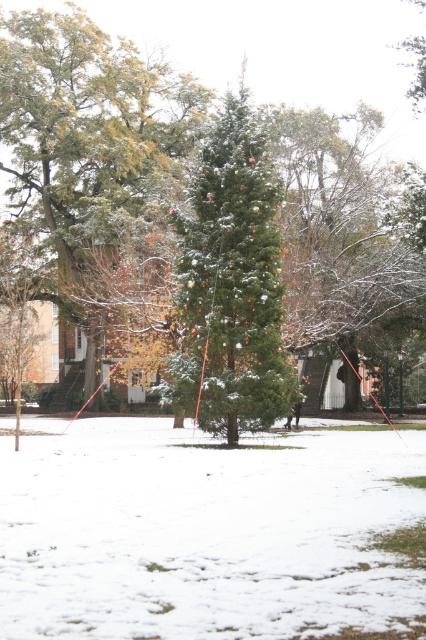
You are standing in the snowy outdoor scene and want to place a small gift exactly at the center of the white fluffy snow at center. According to the coordinates provided, where should you place the gift?

The white fluffy snow at center is located at coordinates point (203, 532), so you should place the gift at that exact point.

You are standing in the snowy outdoor scene and want to know which object is taller between the white fluffy snow at center and the green matte evergreen tree at center. Can you determine which one is taller?

The green matte evergreen tree at center is taller than the white fluffy snow at center.

You are standing in the snowy outdoor scene and want to take a photo of the green matte evergreen tree at center without any snow in the foreground. Is the white fluffy snow at center blocking your view of the tree?

The white fluffy snow at center is in front of the green matte evergreen tree at center, so yes, the snow is blocking the view of the tree.